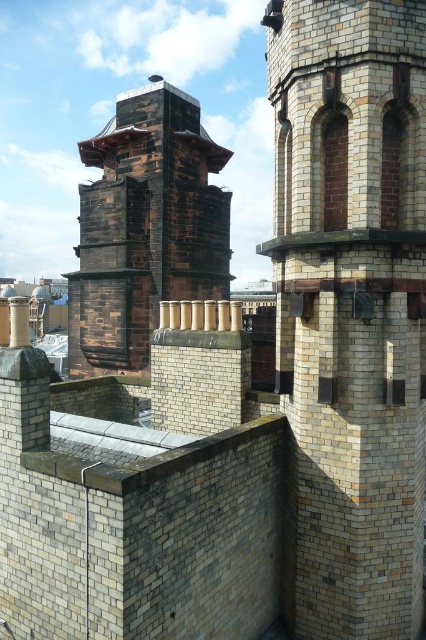
Based on the photo, you are standing in front of the historic building and notice a specific point marked at coordinates [144,227]. What architectural feature is located at that point?

The point at coordinates [144,227] marks the location of the rustic brick chimney at center.

You are standing in front of the historic building and want to take a photo that includes both the white brick tower at center and the shiny metallic roof at upper center. Which object should you adjust your camera angle to focus on first to ensure both are in frame?

Since the white brick tower at center is closer to the viewer than the shiny metallic roof at upper center, you should focus on the white brick tower at center first to ensure it doesn not block the view of the shiny metallic roof at upper center behind it.

You are standing in front of the historic building and want to take a photo. You notice two points marked on the wall at coordinates point (354,426) and point (118,230). Which point is closer to your camera when taking the photo?

Point (354,426) is closer to the camera than point (118,230).